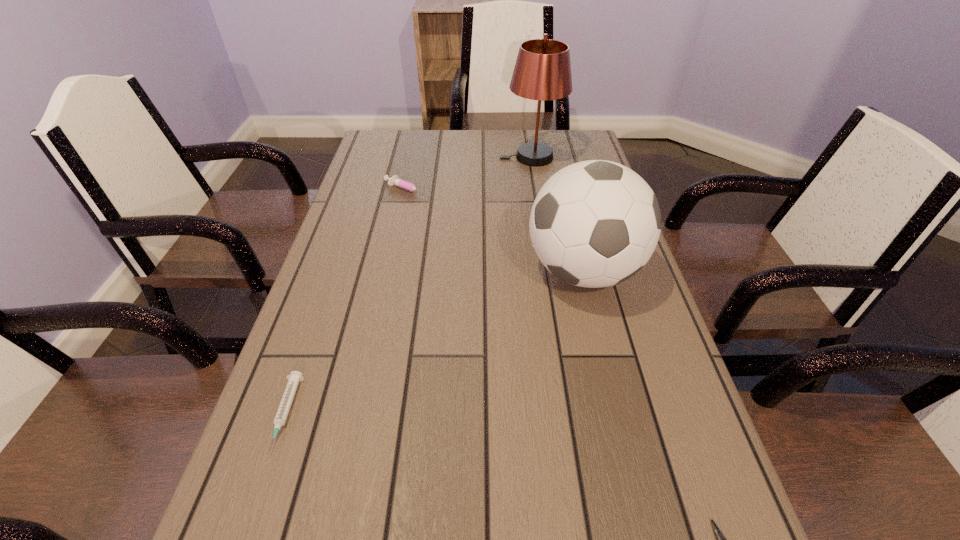
Image resolution: width=960 pixels, height=540 pixels. I want to click on the farthest object, so click(x=542, y=72).

Where is `lampshade`? lampshade is located at coordinates (542, 72).

You are a GUI agent. You are given a task and a screenshot of the screen. Output one action in this format:
    pyautogui.click(x=<x>, y=<y>)
    Task: Click on the soccer ball
    
    Given the screenshot: What is the action you would take?
    point(596,223)

The width and height of the screenshot is (960, 540). In order to click on the third farthest object in this screenshot , I will do `click(596, 223)`.

Find the location of a particular element. The width and height of the screenshot is (960, 540). the fourth object from right to left is located at coordinates (394, 180).

The height and width of the screenshot is (540, 960). Find the location of `the taller syringe`. the taller syringe is located at coordinates (394, 180).

Where is `the nearer syringe`? the nearer syringe is located at coordinates (293, 380).

Image resolution: width=960 pixels, height=540 pixels. I want to click on the second nearest object, so click(293, 380).

This screenshot has height=540, width=960. I want to click on free location located 0.390m on the front-facing side of the tallest object, so click(380, 157).

This screenshot has width=960, height=540. What are the coordinates of `free space located 0.220m on the front-facing side of the tallest object` in the screenshot? It's located at (432, 157).